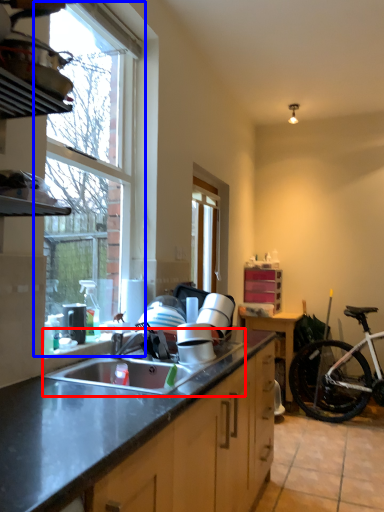
Question: Which object is closer to the camera taking this photo, sink (highlighted by a red box) or window (highlighted by a blue box)?

Choices:
 (A) sink
 (B) window

Answer: (A)